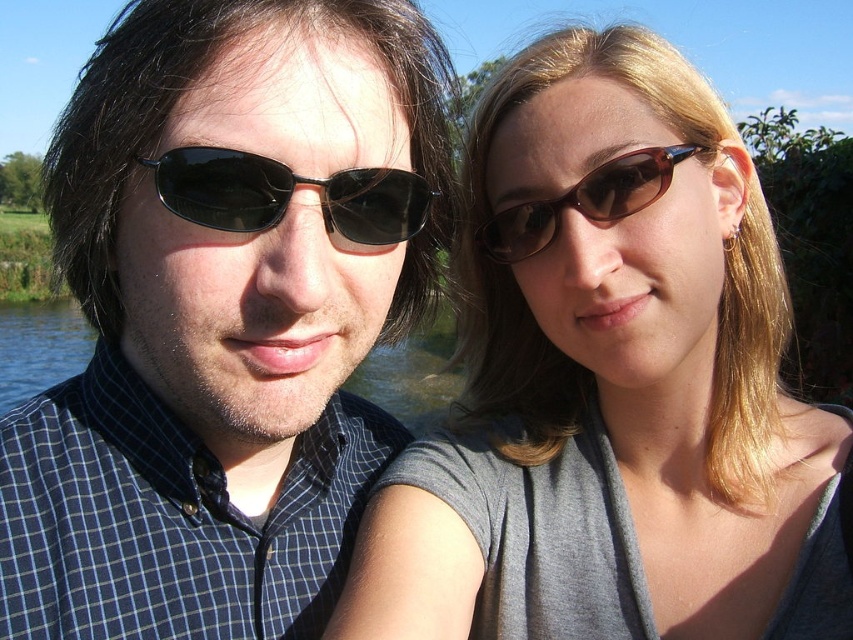
Question: Does matte black sunglasses at left have a greater width compared to matte gray shirt at center?

Choices:
 (A) yes
 (B) no

Answer: (B)

Question: From the image, what is the correct spatial relationship of matte black sunglasses at left in relation to black matte sunglasses at left?

Choices:
 (A) left
 (B) right

Answer: (A)

Question: Which point is closer to the camera?

Choices:
 (A) matte black sunglasses at left
 (B) brown matte sunglasses at upper center
 (C) matte gray shirt at center

Answer: (A)

Question: Does matte black sunglasses at left appear under black matte sunglasses at left?

Choices:
 (A) yes
 (B) no

Answer: (A)

Question: Which point is farther from the camera taking this photo?

Choices:
 (A) (525, 88)
 (B) (194, 180)
 (C) (252, 618)

Answer: (A)

Question: Which point is farther to the camera?

Choices:
 (A) matte black sunglasses at left
 (B) matte gray shirt at center
 (C) brown matte sunglasses at upper center
 (D) black matte sunglasses at left

Answer: (C)